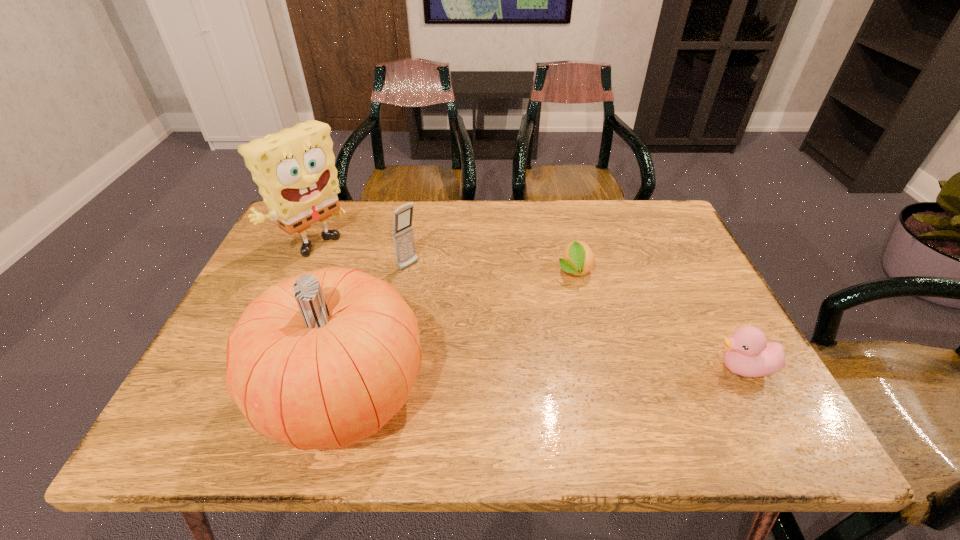
Locate an element on the screen. free point between the fourth object from left to right and the pumpkin is located at coordinates (459, 333).

Locate an element on the screen. This screenshot has height=540, width=960. free space between the rightmost object and the sponge is located at coordinates (529, 309).

This screenshot has width=960, height=540. What are the coordinates of `vacant space that's between the second shortest object and the shortest object` in the screenshot? It's located at (659, 320).

The width and height of the screenshot is (960, 540). Identify the location of vacant area that lies between the fourth object from left to right and the pumpkin. (459, 333).

You are a GUI agent. You are given a task and a screenshot of the screen. Output one action in this format:
    pyautogui.click(x=<x>, y=<y>)
    Task: Click on the vacant space in between the shortest object and the cellular telephone
    This screenshot has height=540, width=960.
    Given the screenshot: What is the action you would take?
    pyautogui.click(x=492, y=268)

This screenshot has height=540, width=960. I want to click on vacant space that is in between the sponge and the lemon, so click(x=444, y=260).

Choose which object is the third nearest neighbor to the pumpkin. Please provide its 2D coordinates. Your answer should be formatted as a tuple, i.e. [(x, y)], where the tuple contains the x and y coordinates of a point satisfying the conditions above.

[(578, 259)]

Point out which object is positioned as the second nearest to the sponge. Please provide its 2D coordinates. Your answer should be formatted as a tuple, i.e. [(x, y)], where the tuple contains the x and y coordinates of a point satisfying the conditions above.

[(323, 360)]

At what (x,y) coordinates should I click in order to perform the action: click on free space that satisfies the following two spatial constraints: 1. on the front side of the second object from right to left; 2. on the front-facing side of the duckling. Please return your answer as a coordinate pair (x, y). The height and width of the screenshot is (540, 960). Looking at the image, I should click on (597, 368).

Find the location of a particular element. This screenshot has width=960, height=540. free spot that satisfies the following two spatial constraints: 1. on the front side of the second shortest object; 2. on the front-facing side of the shortest object is located at coordinates (597, 368).